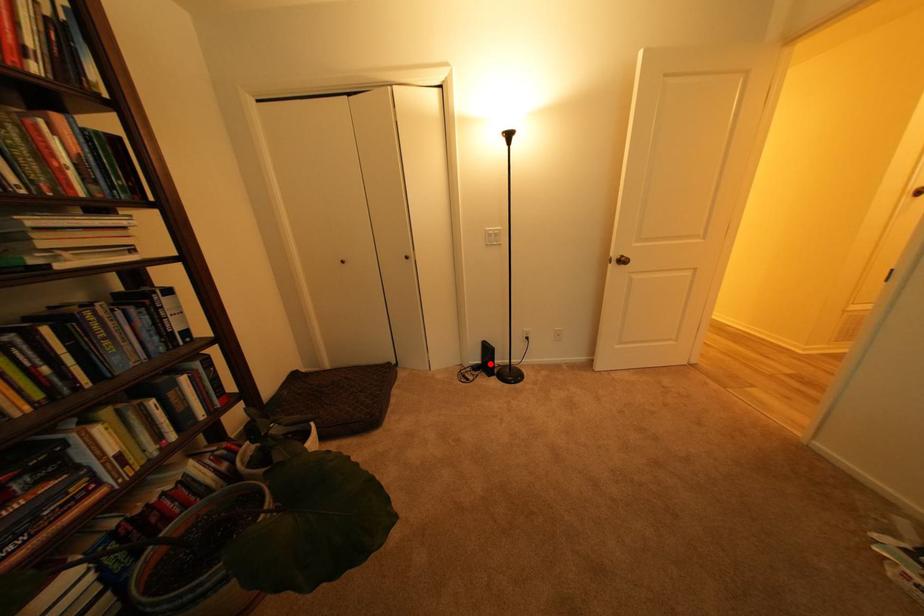
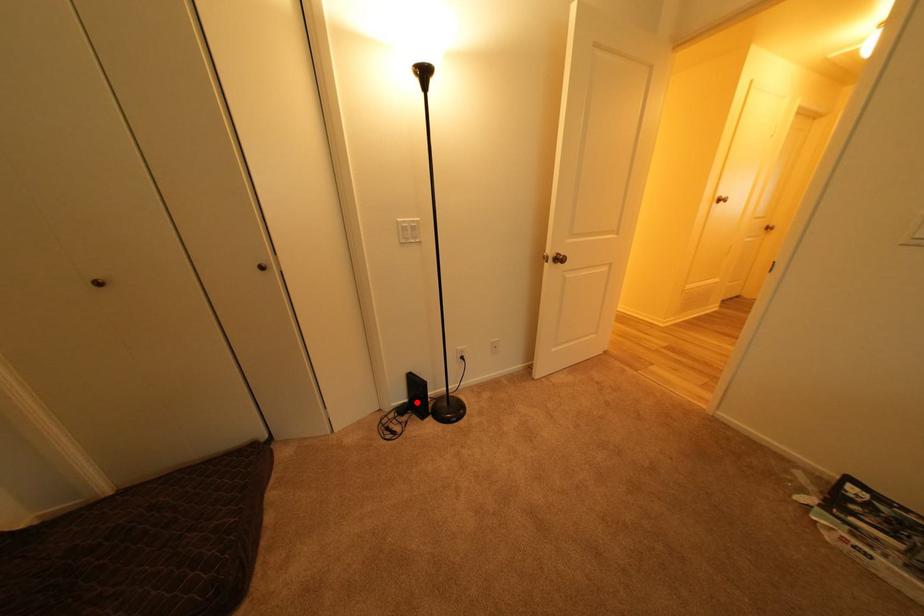
I am providing you with two images of the same scene from different viewpoints. A red point is marked on the first image and another point is marked on the second image. Do the highlighted points in image1 and image2 indicate the same real-world spot?

Yes